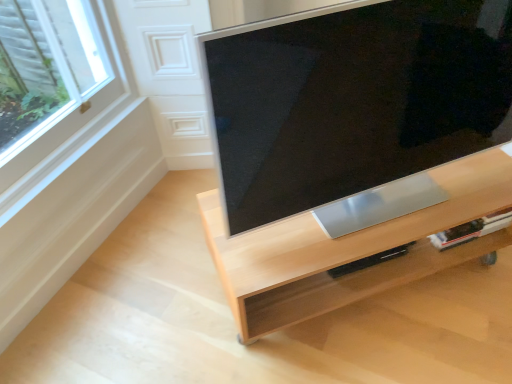
Locate an element on the screen. The image size is (512, 384). free location to the left of light wood tv stand at center is located at coordinates (158, 288).